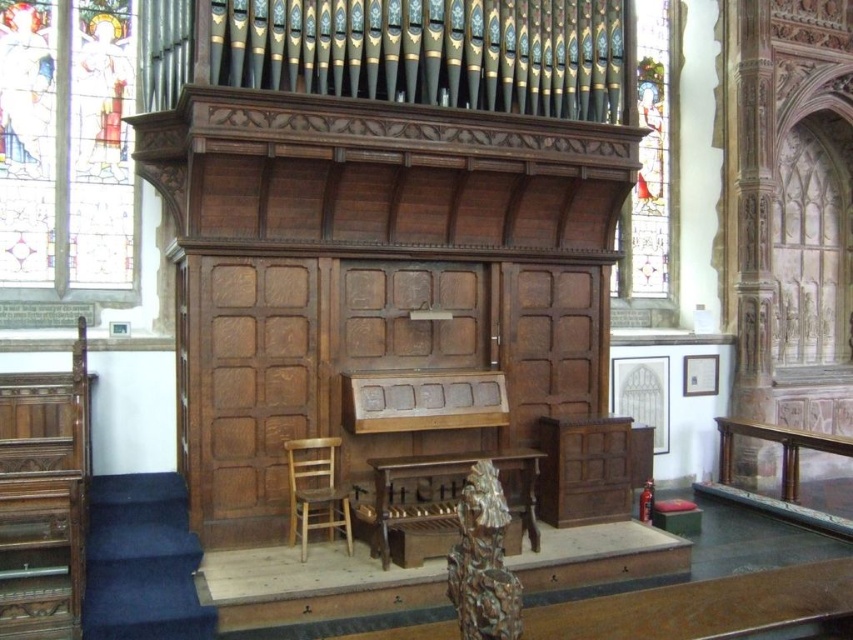
Question: Which object is the closest to the stained glass window at upper right?

Choices:
 (A) stained glass window at upper left
 (B) wooden altar at center

Answer: (B)

Question: Which point is farther to the camera?

Choices:
 (A) stained glass window at upper left
 (B) wooden altar at center
 (C) stained glass window at upper right

Answer: (C)

Question: Does stained glass window at upper left have a greater width compared to wooden chair at lower left?

Choices:
 (A) no
 (B) yes

Answer: (B)

Question: Which of the following is the closest to the observer?

Choices:
 (A) (668, 269)
 (B) (297, 483)
 (C) (28, 216)

Answer: (B)

Question: Does stained glass window at upper left have a larger size compared to wooden chair at lower left?

Choices:
 (A) yes
 (B) no

Answer: (A)

Question: Is stained glass window at upper right below wooden chair at lower left?

Choices:
 (A) yes
 (B) no

Answer: (B)